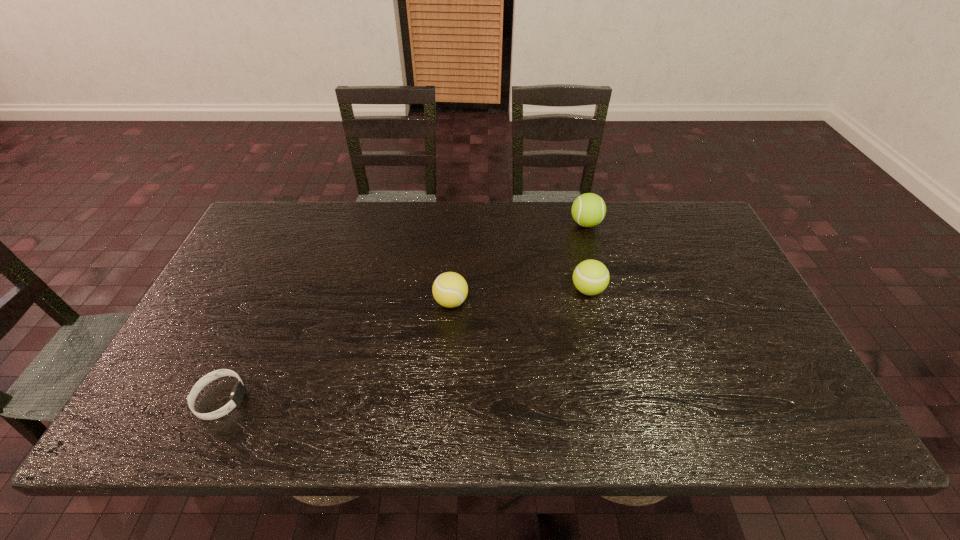
Find the location of `the farthest tennis ball`. the farthest tennis ball is located at coordinates (588, 210).

The height and width of the screenshot is (540, 960). I want to click on the third object from right to left, so click(450, 289).

Where is `the nearest object`? The image size is (960, 540). the nearest object is located at coordinates (236, 397).

Identify the location of the leftmost object. (236, 397).

Identify the location of free point located on the left of the farthest object. This screenshot has height=540, width=960. (483, 224).

The image size is (960, 540). Find the location of `blank space located on the right of the second object from left to right`. blank space located on the right of the second object from left to right is located at coordinates (520, 302).

Find the location of a particular element. The width and height of the screenshot is (960, 540). vacant area situated on the outer surface of the leftmost object is located at coordinates (373, 399).

Identify the location of object present at the far edge. The image size is (960, 540). (588, 210).

The height and width of the screenshot is (540, 960). I want to click on object at the near edge, so click(236, 397).

This screenshot has height=540, width=960. I want to click on object at the left edge, so click(x=236, y=397).